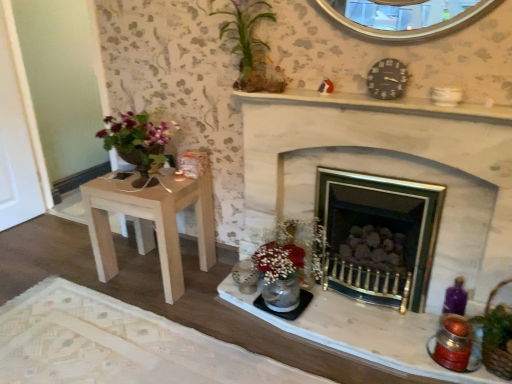
Locate an element on the screen. This screenshot has height=384, width=512. vacant space underneath shiny metallic candle holder at lower right, acting as the first candle holder starting from the right (from a real-world perspective) is located at coordinates (444, 353).